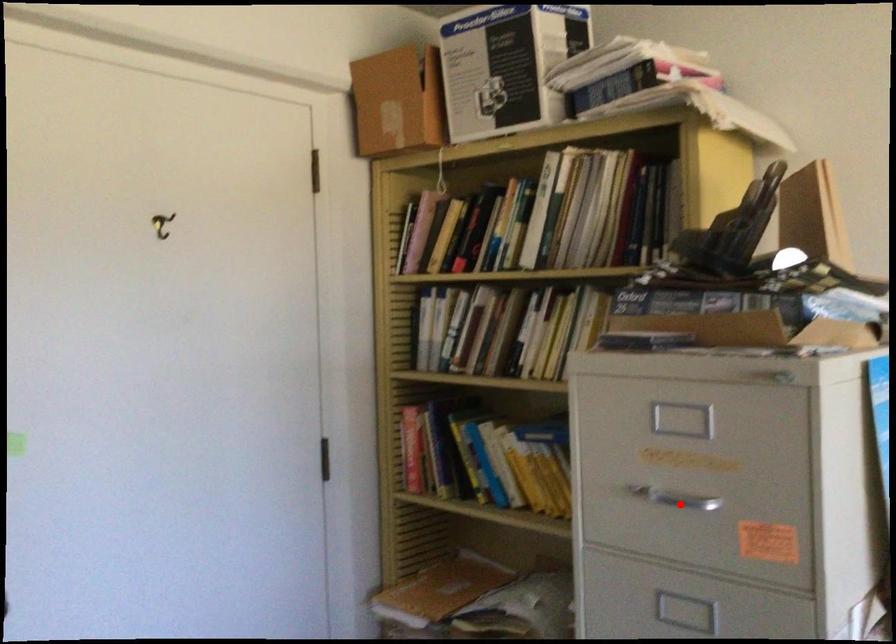
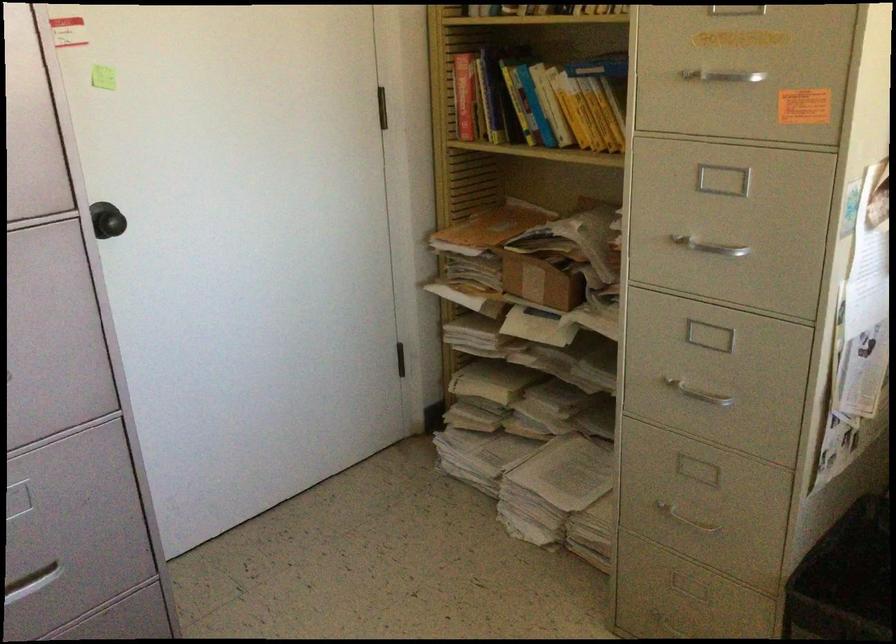
Where in the second image is the point corresponding to the highlighted location from the first image?

(725, 82)